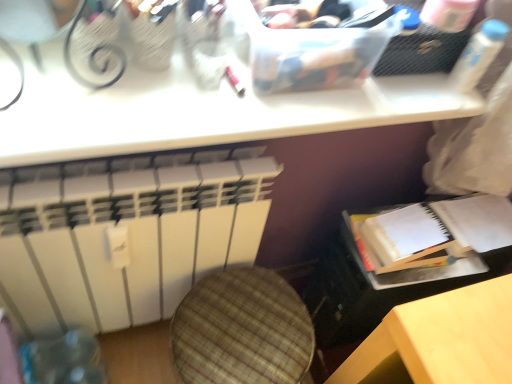
The width and height of the screenshot is (512, 384). I want to click on vacant area on top of white plastic table at upper center (from a real-world perspective), so [x=240, y=88].